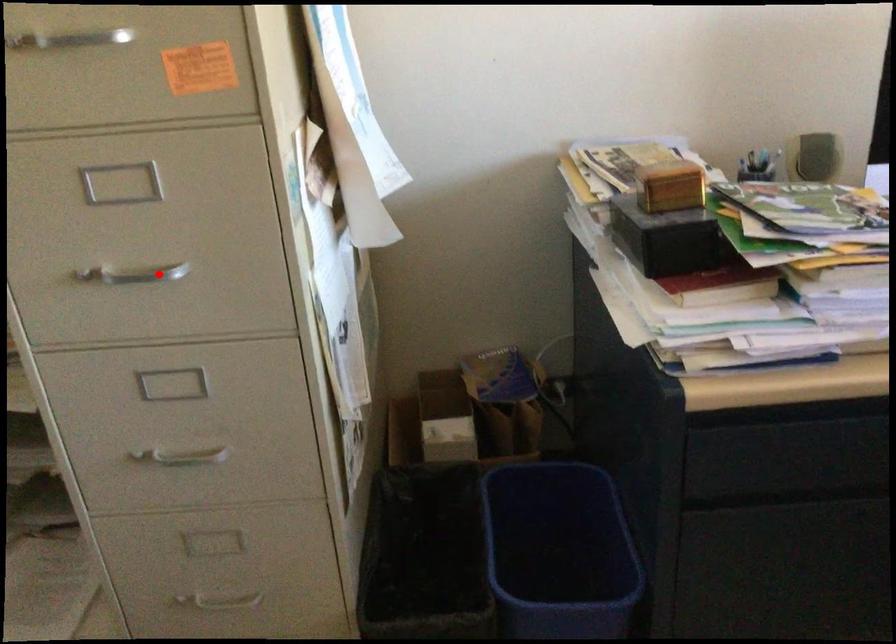
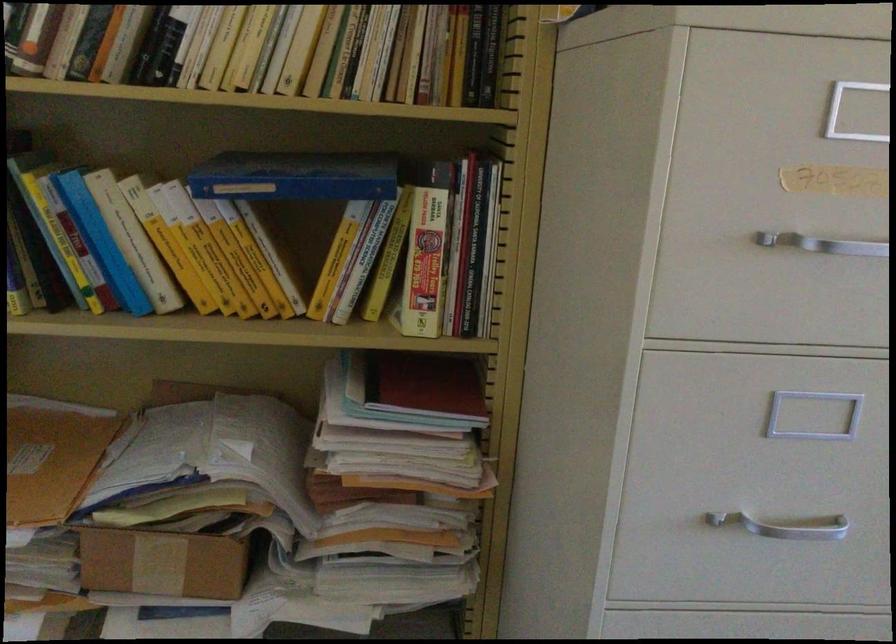
Where in the second image is the point corresponding to the highlighted location from the first image?

(784, 526)